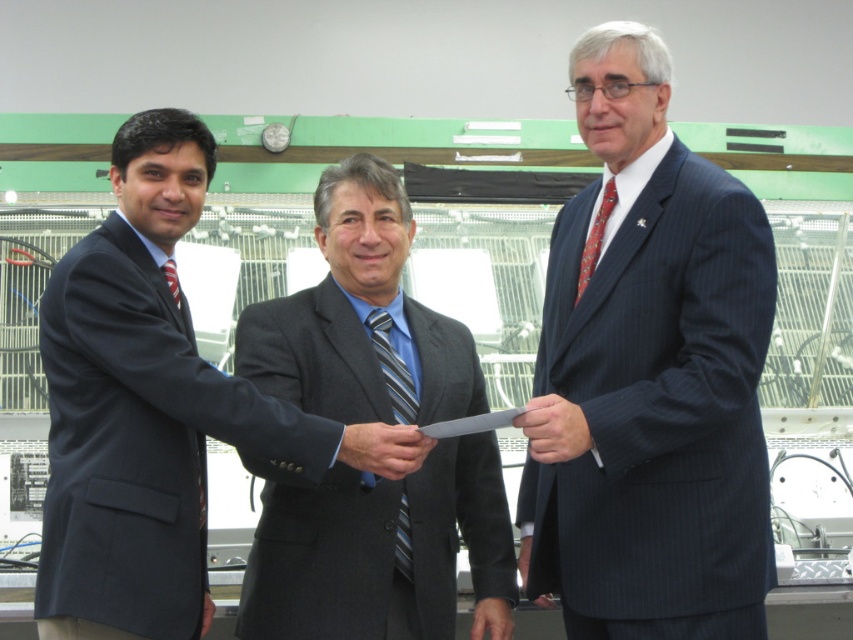
Question: Does pinstriped suit at center have a larger size compared to dark gray suit at center?

Choices:
 (A) yes
 (B) no

Answer: (A)

Question: Which object is positioned closest to the dark gray suit at center?

Choices:
 (A) matte black knife at center
 (B) red textured tie at right
 (C) striped fabric tie at center
 (D) matte black tie at left

Answer: (C)

Question: Estimate the real-world distances between objects in this image. Which object is farther from the matte black suit at left?

Choices:
 (A) matte black knife at center
 (B) red textured tie at right
 (C) matte black tie at left
 (D) pinstriped suit at center

Answer: (B)

Question: Which of the following is the farthest from the observer?

Choices:
 (A) (392, 461)
 (B) (408, 497)
 (C) (405, 506)
 (D) (573, 300)

Answer: (C)

Question: Can you confirm if matte black suit at center is positioned to the right of red textured tie at right?

Choices:
 (A) no
 (B) yes

Answer: (A)

Question: Observing the image, what is the correct spatial positioning of red textured tie at right in reference to matte black tie at left?

Choices:
 (A) above
 (B) below

Answer: (A)